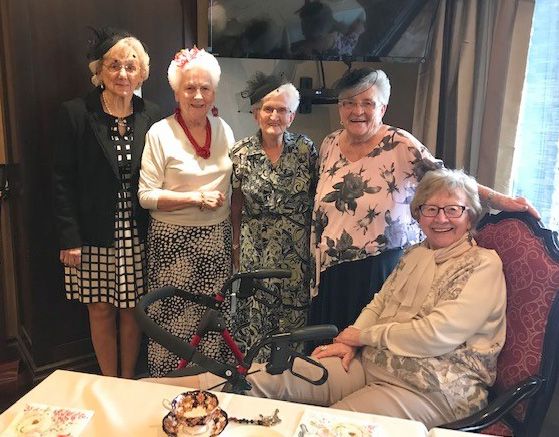
You are a GUI agent. You are given a task and a screenshot of the screen. Output one action in this format:
    pyautogui.click(x=<x>, y=<y>)
    Task: Click on the chair
    
    Given the screenshot: What is the action you would take?
    pyautogui.click(x=523, y=276)